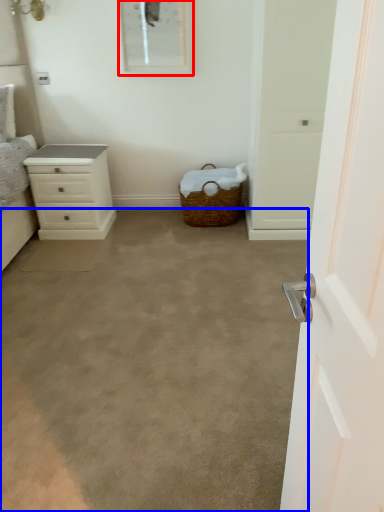
Question: Among these objects, which one is nearest to the camera, picture frame (highlighted by a red box) or plain (highlighted by a blue box)?

Choices:
 (A) picture frame
 (B) plain

Answer: (B)